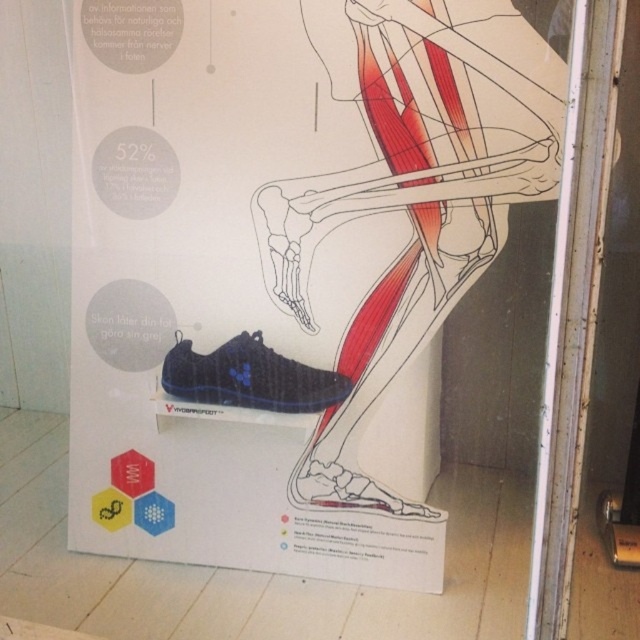
How much distance is there between matte black shoe at lower left and matte blue shoe at center?

The distance of matte black shoe at lower left from matte blue shoe at center is 6.89 inches.

Can you confirm if matte black shoe at lower left is bigger than matte blue shoe at center?

Correct, matte black shoe at lower left is larger in size than matte blue shoe at center.

Identify the location of matte black shoe at lower left. (280, 256).

You are a GUI agent. You are given a task and a screenshot of the screen. Output one action in this format:
    pyautogui.click(x=<x>, y=<y>)
    Task: Click on the matte black shoe at lower left
    The image size is (640, 640).
    Given the screenshot: What is the action you would take?
    pyautogui.click(x=280, y=256)

This screenshot has width=640, height=640. What do you see at coordinates (280, 256) in the screenshot?
I see `matte black shoe at lower left` at bounding box center [280, 256].

Who is taller, matte black shoe at lower left or matte black shoe at lower right?

With more height is matte black shoe at lower left.

Which is in front, point (365, 384) or point (355, 492)?

Positioned in front is point (355, 492).

Identify the location of matte black shoe at lower left. The width and height of the screenshot is (640, 640). coord(280,256).

Does matte blue shoe at center lie behind matte black shoe at lower right?

That is True.

Does matte blue shoe at center appear over matte black shoe at lower right?

Correct, matte blue shoe at center is located above matte black shoe at lower right.

Which is in front, point (310, 412) or point (358, 508)?

Point (358, 508) is in front.

At what (x,y) coordinates should I click in order to perform the action: click on matte blue shoe at center. Please return your answer as a coordinate pair (x, y). This screenshot has width=640, height=640. Looking at the image, I should click on (250, 378).